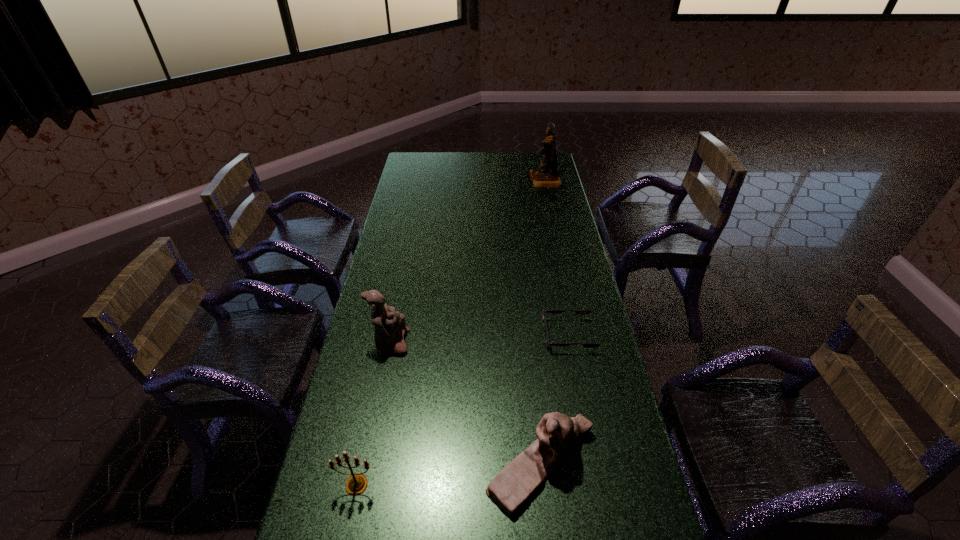
The width and height of the screenshot is (960, 540). In order to click on free space between the sunglasses and the tallest figurine in this screenshot , I will do `click(557, 258)`.

The image size is (960, 540). Find the location of `free spot between the shortest object and the second tallest object`. free spot between the shortest object and the second tallest object is located at coordinates (479, 339).

Where is `vacant space in between the second farthest figurine and the sunglasses`? This screenshot has height=540, width=960. vacant space in between the second farthest figurine and the sunglasses is located at coordinates (479, 339).

Identify the location of vacant area that lies between the candelabrum and the sunglasses. The image size is (960, 540). (463, 410).

In order to click on vacant space that is in between the farthest object and the shortest figurine in this screenshot , I will do `click(543, 321)`.

This screenshot has height=540, width=960. I want to click on free space between the shortest object and the nearest figurine, so click(x=555, y=399).

Identify the location of unoccupied position between the tallest object and the candelabrum. The height and width of the screenshot is (540, 960). (451, 333).

At what (x,y) coordinates should I click in order to perform the action: click on object that is the fourth closest to the fourth shortest object. Please return your answer as a coordinate pair (x, y). Image resolution: width=960 pixels, height=540 pixels. Looking at the image, I should click on (546, 175).

Select which object appears as the closest to the candelabrum. Please provide its 2D coordinates. Your answer should be formatted as a tuple, i.e. [(x, y)], where the tuple contains the x and y coordinates of a point satisfying the conditions above.

[(558, 435)]

Point out which figurine is positioned as the nearest to the nearest figurine. Please provide its 2D coordinates. Your answer should be formatted as a tuple, i.e. [(x, y)], where the tuple contains the x and y coordinates of a point satisfying the conditions above.

[(390, 327)]